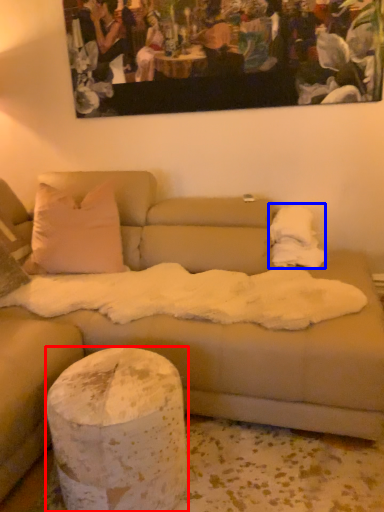
Question: Which of the following is the farthest to the observer, pillar (highlighted by a red box) or blanket (highlighted by a blue box)?

Choices:
 (A) pillar
 (B) blanket

Answer: (B)